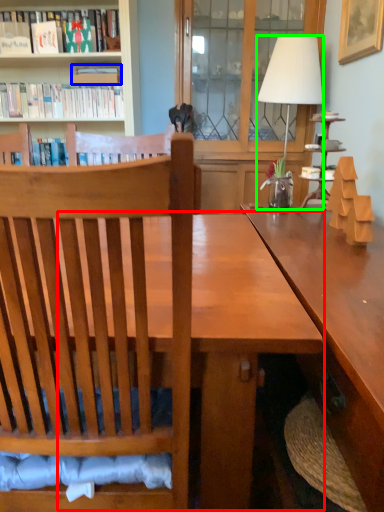
Question: Which object is positioned closest to table (highlighted by a red box)? Select from book (highlighted by a blue box) and lamp (highlighted by a green box).

Choices:
 (A) book
 (B) lamp

Answer: (B)